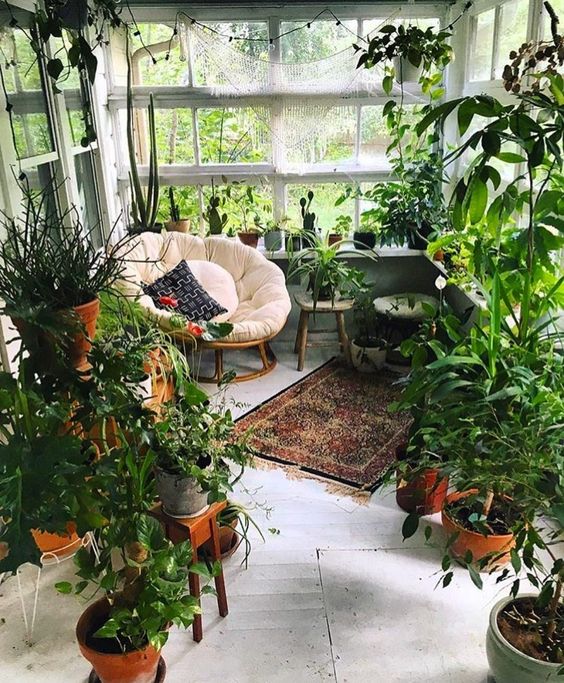
Locate an element on the screen. orange pot is located at coordinates (116, 666), (486, 546), (430, 479), (226, 535), (45, 541), (90, 313), (336, 238), (438, 257), (250, 240).